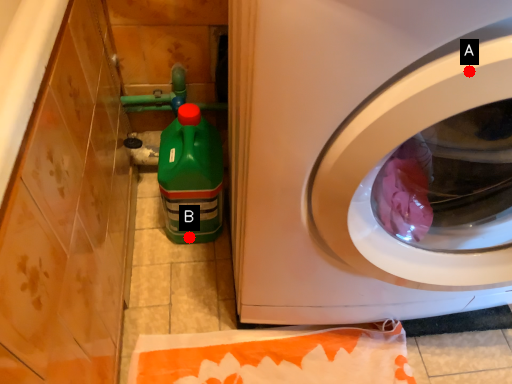
Question: Two points are circled on the image, labeled by A and B beside each circle. Which point is farther from the camera taking this photo?

Choices:
 (A) A is further
 (B) B is further

Answer: (B)